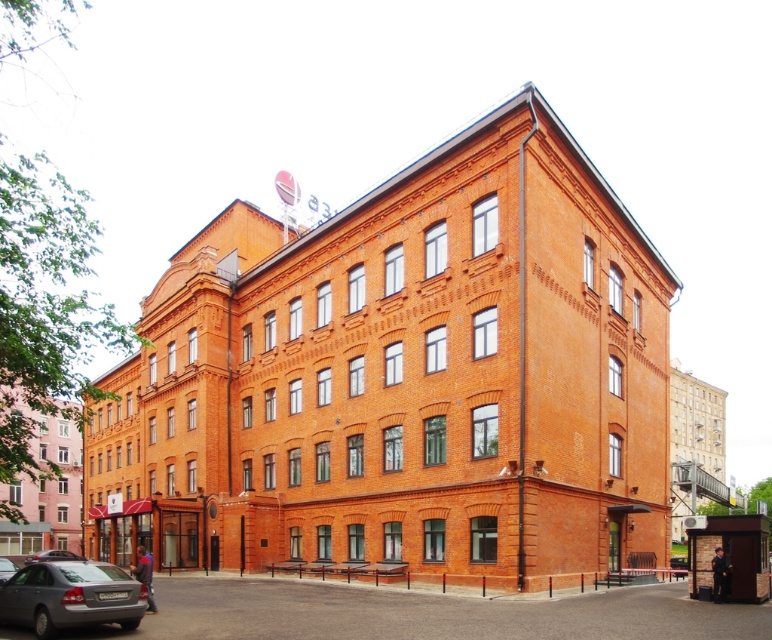
Question: Which point appears farthest from the camera in this image?

Choices:
 (A) (73, 568)
 (B) (68, 554)
 (C) (12, 566)

Answer: (B)

Question: Does silver metallic car at lower left have a greater width compared to matte black car at lower left?

Choices:
 (A) no
 (B) yes

Answer: (A)

Question: Estimate the real-world distances between objects in this image. Which object is closer to the matte black car at lower left?

Choices:
 (A) silver metallic car at lower left
 (B) metallic gray sedan at lower left

Answer: (B)

Question: Among these points, which one is nearest to the camera?

Choices:
 (A) (127, 592)
 (B) (63, 552)
 (C) (0, 573)

Answer: (A)

Question: Does silver metallic car at lower left have a lesser width compared to matte black car at lower left?

Choices:
 (A) no
 (B) yes

Answer: (B)

Question: Does matte black car at lower left appear over metallic gray sedan at lower left?

Choices:
 (A) no
 (B) yes

Answer: (A)